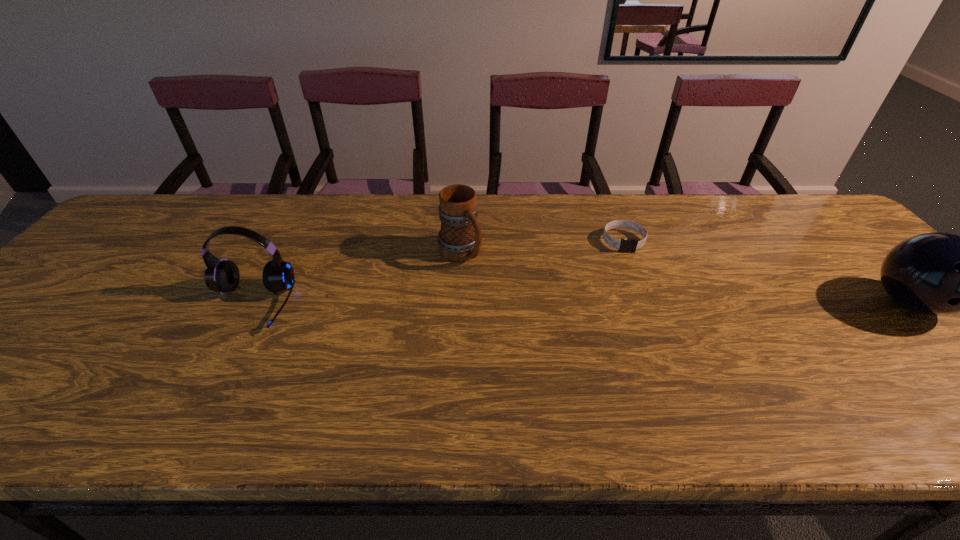
Image resolution: width=960 pixels, height=540 pixels. Identify the location of the leftmost object. (222, 275).

Find the location of `the third object from right to left`. the third object from right to left is located at coordinates (460, 238).

This screenshot has height=540, width=960. Identify the location of the second object from right to left. (625, 245).

Identify the location of the shortest object. The image size is (960, 540). (625, 245).

Where is `vacant space situated 0.120m on the ear cushions of the headset`? The image size is (960, 540). vacant space situated 0.120m on the ear cushions of the headset is located at coordinates coord(210,379).

The height and width of the screenshot is (540, 960). I want to click on vacant area situated on the side of the second object from left to right with the handle, so click(x=566, y=365).

Where is `vacant region located 0.120m on the side of the second object from left to right with the handle`? vacant region located 0.120m on the side of the second object from left to right with the handle is located at coordinates (497, 294).

This screenshot has width=960, height=540. Find the location of `vacant area situated 0.190m on the side of the second object from left to right with the handle`. vacant area situated 0.190m on the side of the second object from left to right with the handle is located at coordinates (514, 311).

Find the location of a particular element. The image size is (960, 540). free space located on the outer surface of the shortest object is located at coordinates (645, 305).

Locate an element on the screen. The image size is (960, 540). free space located on the outer surface of the shortest object is located at coordinates (640, 291).